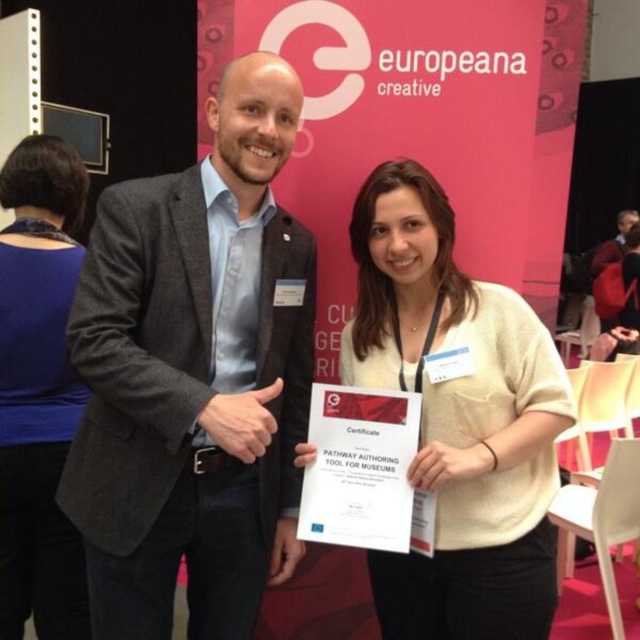
Question: Among these objects, which one is farthest from the camera?

Choices:
 (A) blue fabric shirt at upper left
 (B) white cotton shirt at center

Answer: (A)

Question: Which of the following is the closest to the observer?

Choices:
 (A) (451, 589)
 (B) (204, 435)

Answer: (B)

Question: Among these points, which one is farthest from the camera?

Choices:
 (A) (412, 560)
 (B) (67, 145)

Answer: (B)

Question: Is white cotton shirt at center wider than blue fabric shirt at upper left?

Choices:
 (A) yes
 (B) no

Answer: (A)

Question: Does gray woolen blazer at center have a smaller size compared to blue fabric shirt at upper left?

Choices:
 (A) no
 (B) yes

Answer: (A)

Question: Does gray woolen blazer at center appear on the left side of blue fabric shirt at upper left?

Choices:
 (A) yes
 (B) no

Answer: (B)